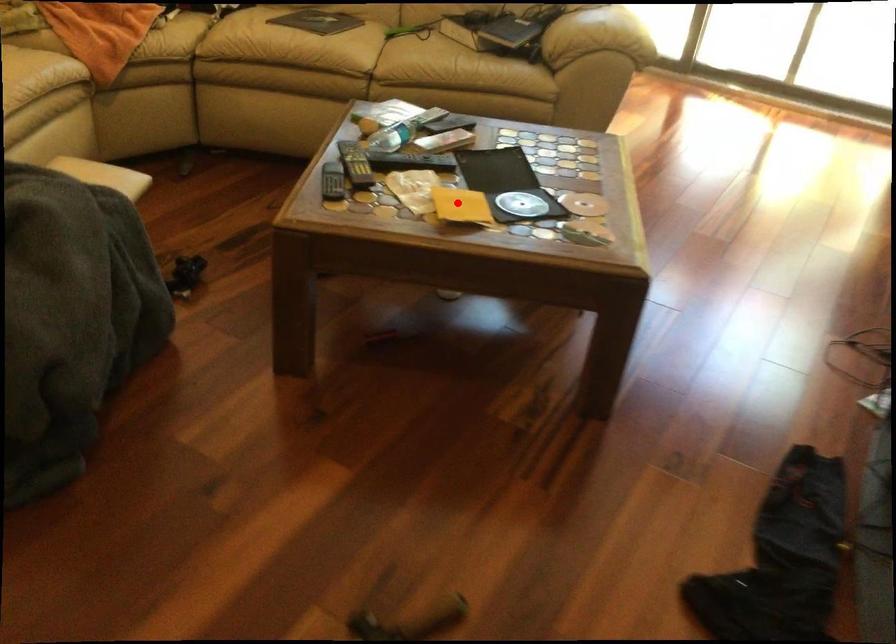
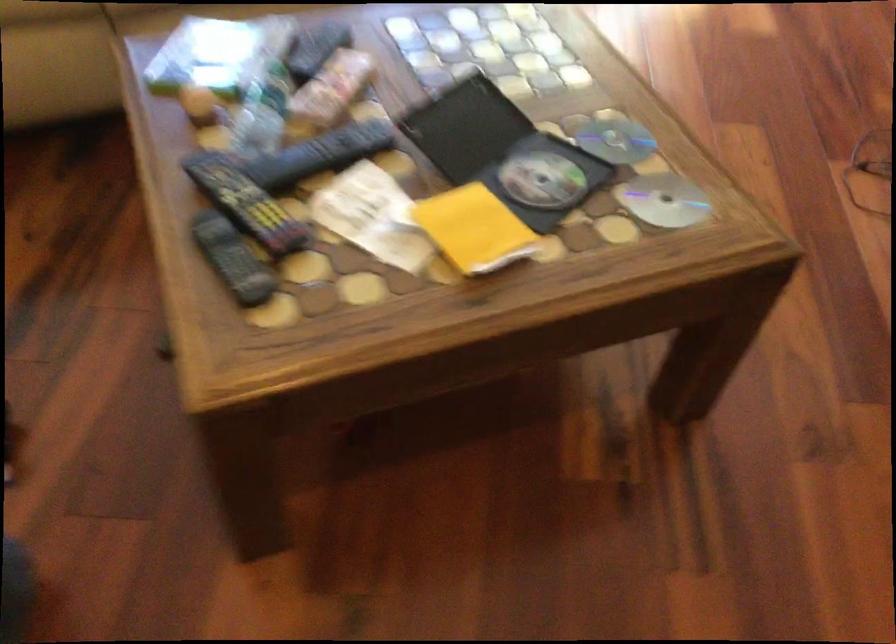
Question: I am providing you with two images of the same scene from different viewpoints. Given a red point in image1, look at the same physical point in image2. Is it:

Choices:
 (A) Closer to the viewpoint
 (B) Farther from the viewpoint

Answer: (A)